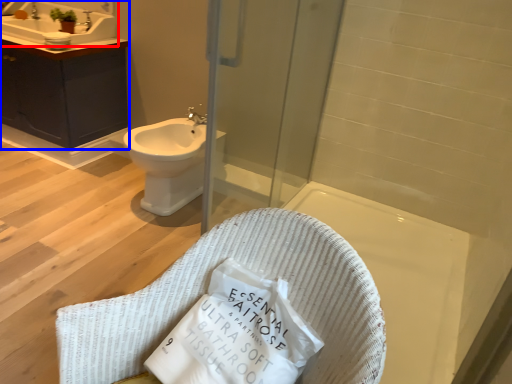
Question: Among these objects, which one is nearest to the camera, sink (highlighted by a red box) or bathroom cabinet (highlighted by a blue box)?

Choices:
 (A) sink
 (B) bathroom cabinet

Answer: (B)